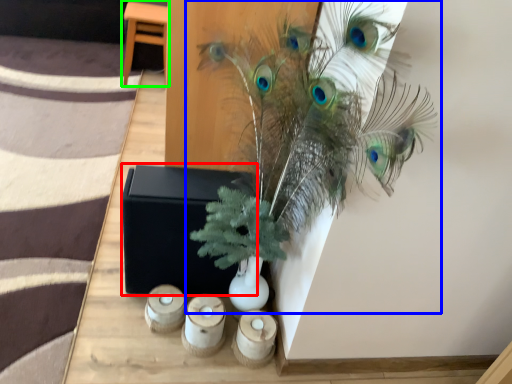
Question: Which object is the closest to the box (highlighted by a red box)? Choose among these: houseplant (highlighted by a blue box) or furniture (highlighted by a green box).

Choices:
 (A) houseplant
 (B) furniture

Answer: (A)